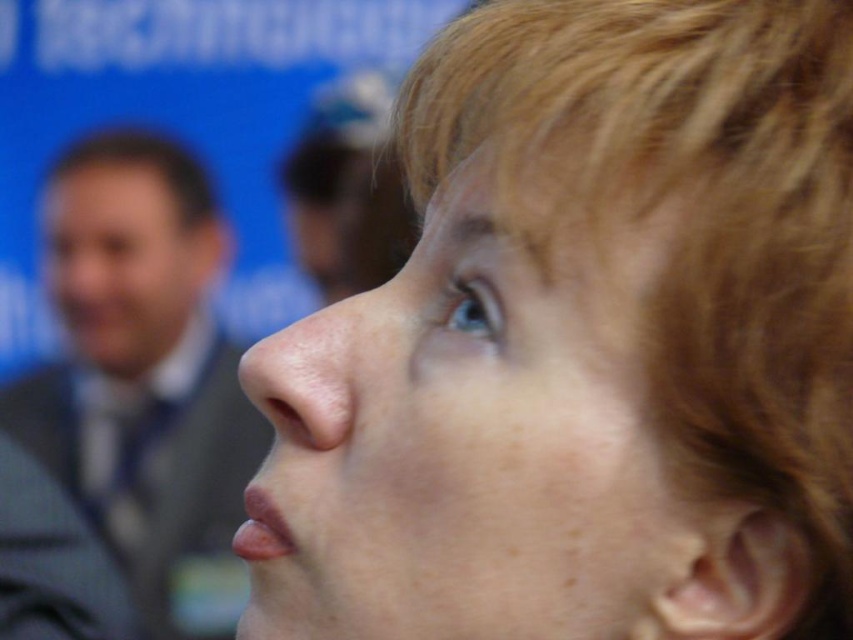
Is smooth skin face at center taller than matte gray suit at upper left?

No.

In the scene shown: Who is shorter, smooth skin face at center or matte gray suit at upper left?

With less height is smooth skin face at center.

Is point (845, 538) farther from camera compared to point (337, 96)?

That is False.

Locate an element on the screen. The height and width of the screenshot is (640, 853). smooth skin face at center is located at coordinates (584, 346).

Can you confirm if gray suit at left is positioned to the left of brown matte hair at left?

Yes, gray suit at left is to the left of brown matte hair at left.

Between point (76, 353) and point (90, 136), which one is positioned in front?

Point (76, 353) is more forward.

Which is behind, point (183, 356) or point (100, 156)?

The point (183, 356) is behind.

Image resolution: width=853 pixels, height=640 pixels. Identify the location of gray suit at left. (138, 358).

Does matte gray suit at upper left have a lesser height compared to brown matte hair at left?

A: In fact, matte gray suit at upper left may be taller than brown matte hair at left.

Describe the element at coordinates (349, 188) in the screenshot. The height and width of the screenshot is (640, 853). I see `matte gray suit at upper left` at that location.

Image resolution: width=853 pixels, height=640 pixels. Find the location of `matte gray suit at upper left`. matte gray suit at upper left is located at coordinates (349, 188).

At what (x,y) coordinates should I click in order to perform the action: click on matte gray suit at upper left. Please return your answer as a coordinate pair (x, y). The width and height of the screenshot is (853, 640). Looking at the image, I should click on (x=349, y=188).